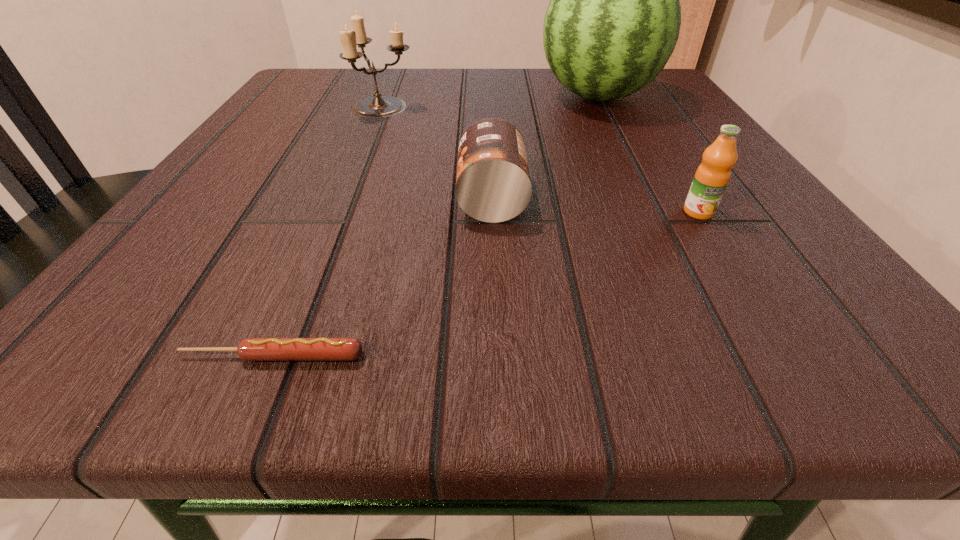
This screenshot has width=960, height=540. Find the location of `empty space between the third object from left to right and the watermelon`. empty space between the third object from left to right and the watermelon is located at coordinates (545, 147).

Find the location of `empty space between the third tallest object and the fourth shortest object`. empty space between the third tallest object and the fourth shortest object is located at coordinates (540, 159).

Identify the location of vacant space that's between the candle holder and the third object from right to left. (438, 152).

Image resolution: width=960 pixels, height=540 pixels. I want to click on free space between the can and the fourth shortest object, so click(438, 152).

At what (x,y) coordinates should I click in order to perform the action: click on unoccupied position between the can and the third tallest object. Please return your answer as a coordinate pair (x, y). This screenshot has height=540, width=960. Looking at the image, I should click on (595, 205).

Image resolution: width=960 pixels, height=540 pixels. Identify the location of vacant point located between the can and the shortest object. (383, 277).

Where is `vacant space that is in between the third object from right to left and the watermelon`? This screenshot has width=960, height=540. vacant space that is in between the third object from right to left and the watermelon is located at coordinates pos(545,147).

At what (x,y) coordinates should I click in order to perform the action: click on vacant area that lies between the sausage and the watermelon. Please return your answer as a coordinate pair (x, y). Looking at the image, I should click on (436, 226).

You are a GUI agent. You are given a task and a screenshot of the screen. Output one action in this format:
    pyautogui.click(x=<x>, y=<y>)
    Task: Click on the vacant space that's between the can and the sausage
    
    Given the screenshot: What is the action you would take?
    pyautogui.click(x=383, y=277)

Where is `vacant point located between the third object from left to right and the nearest object`? The image size is (960, 540). vacant point located between the third object from left to right and the nearest object is located at coordinates (383, 277).